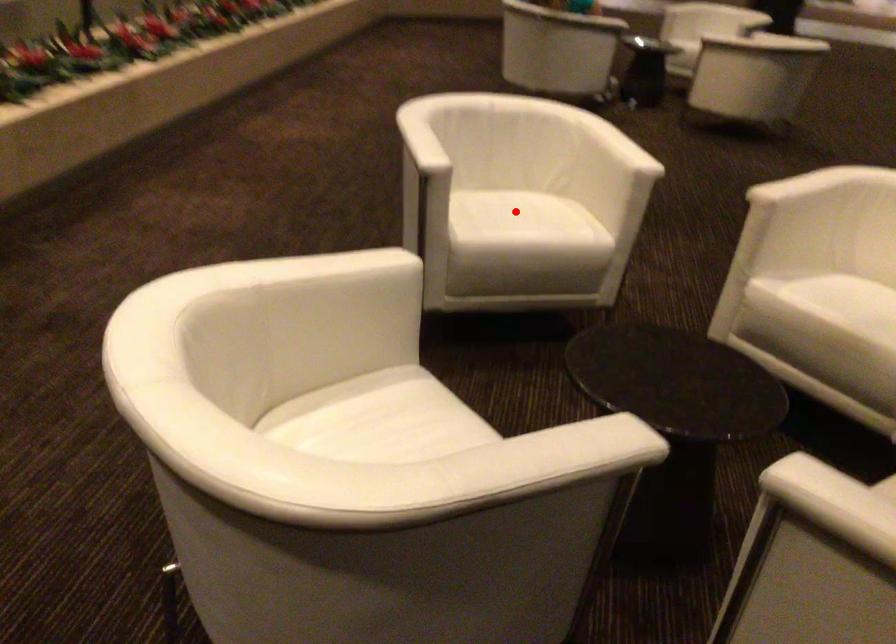
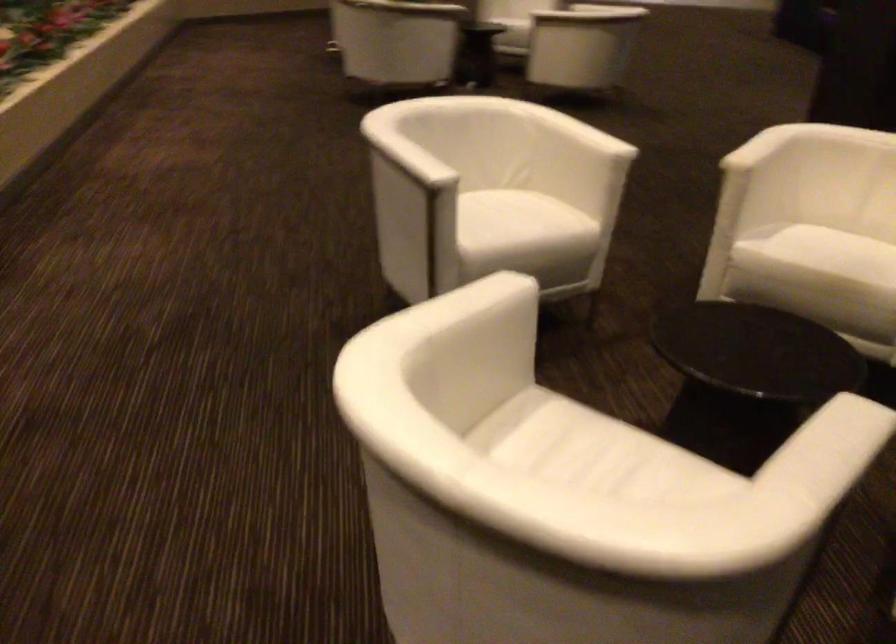
The point at the highlighted location is marked in the first image. Where is the corresponding point in the second image?

(502, 214)